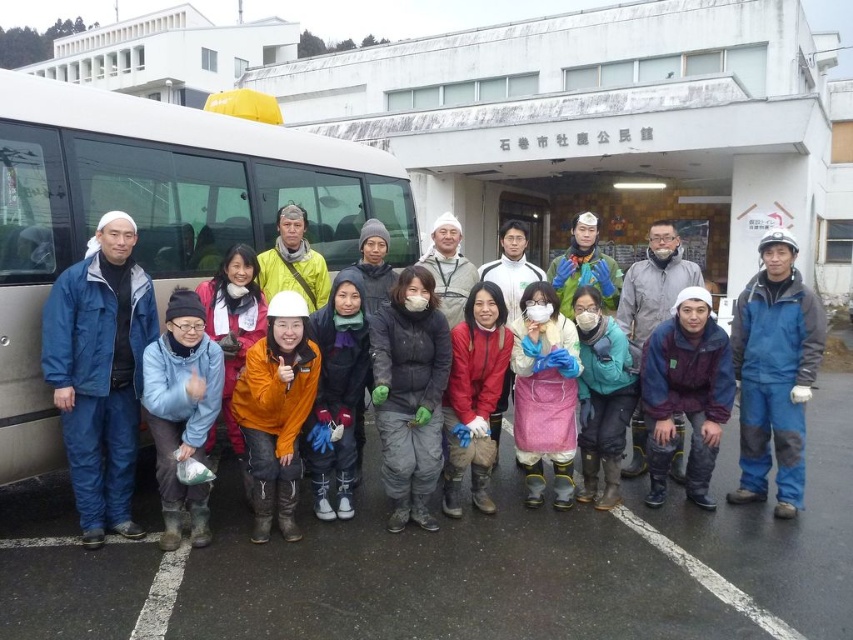
Does blue waterproof suit at left appear under orange fabric jacket at center?

Indeed, blue waterproof suit at left is positioned under orange fabric jacket at center.

Between blue waterproof suit at left and orange fabric jacket at center, which one appears on the left side from the viewer's perspective?

blue waterproof suit at left

Measure the distance between blue waterproof suit at left and camera.

A distance of 4.07 meters exists between blue waterproof suit at left and camera.

Where is `blue waterproof suit at left`? blue waterproof suit at left is located at coordinates (100, 372).

Can you confirm if blue fabric jacket at center is taller than blue-green fabric jacket at center?

Yes, blue fabric jacket at center is taller than blue-green fabric jacket at center.

Is point (177, 355) farther from viewer compared to point (566, 305)?

That is False.

Locate an element on the screen. The width and height of the screenshot is (853, 640). blue fabric jacket at center is located at coordinates (181, 412).

Which of these two, black matte jacket at center or pink fabric at center, stands shorter?

pink fabric at center is shorter.

At what (x,y) coordinates should I click in order to perform the action: click on black matte jacket at center. Please return your answer as a coordinate pair (x, y). Looking at the image, I should click on (409, 394).